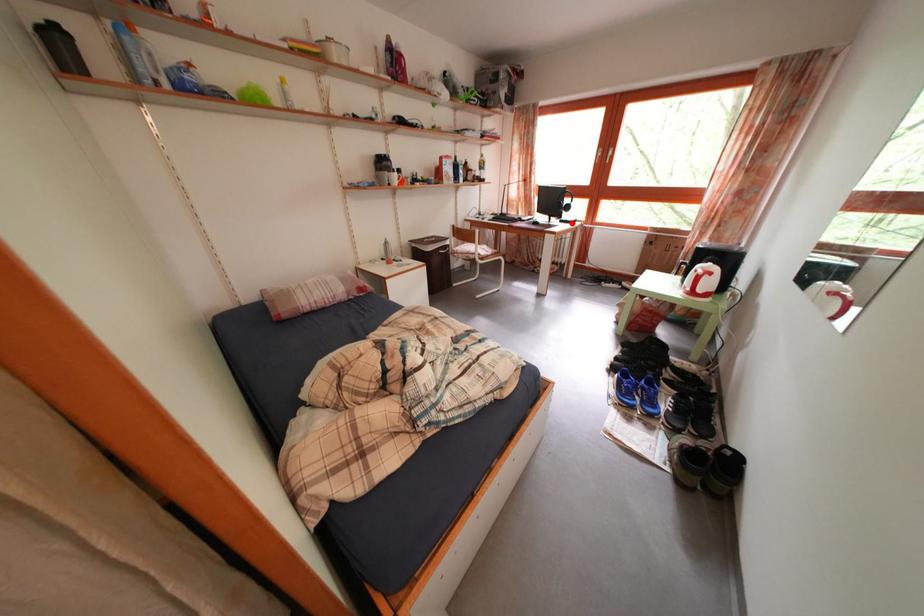
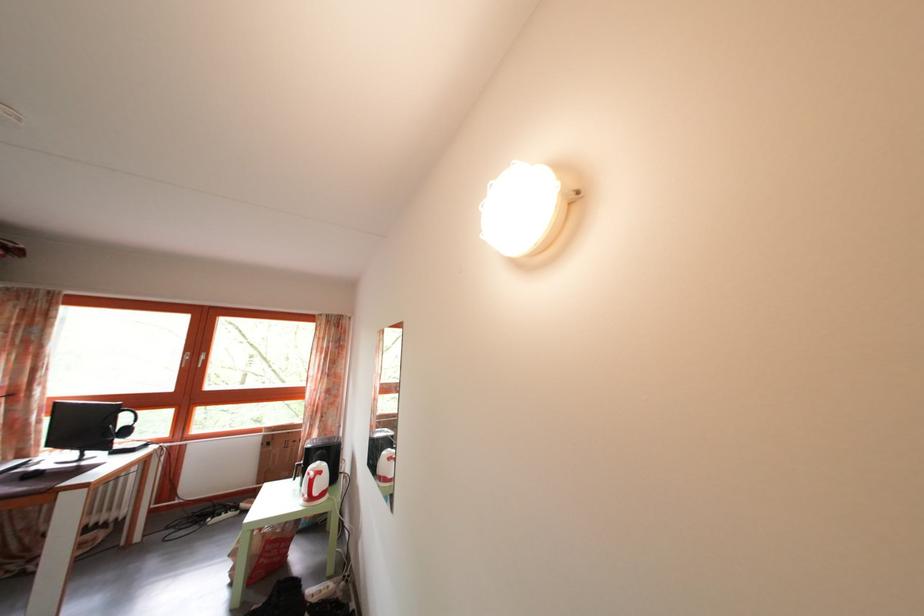
Question: I am providing you with two images of the same scene from different viewpoints. A red point is shown in image1. For the corresponding object point in image2, is it positioned nearer or farther from the camera?

Choices:
 (A) Nearer
 (B) Farther

Answer: (B)